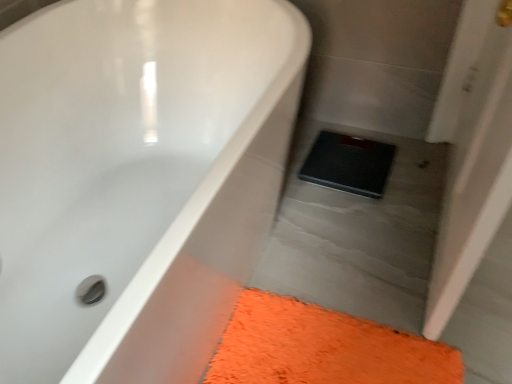
Find the location of `empty space that is ontop of orange shaggy bath mat at lower right (from a real-world perspective)`. empty space that is ontop of orange shaggy bath mat at lower right (from a real-world perspective) is located at coordinates (335, 350).